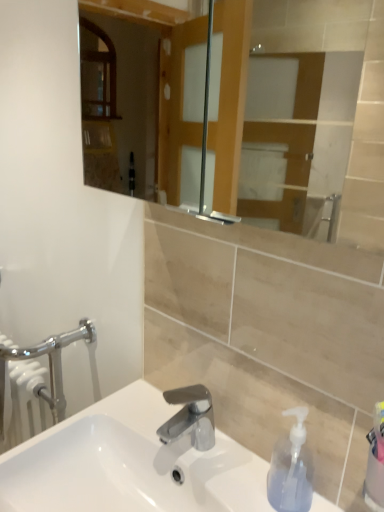
Identify the location of vacant space that is to the left of chrome metallic faucet at center. The height and width of the screenshot is (512, 384). (112, 429).